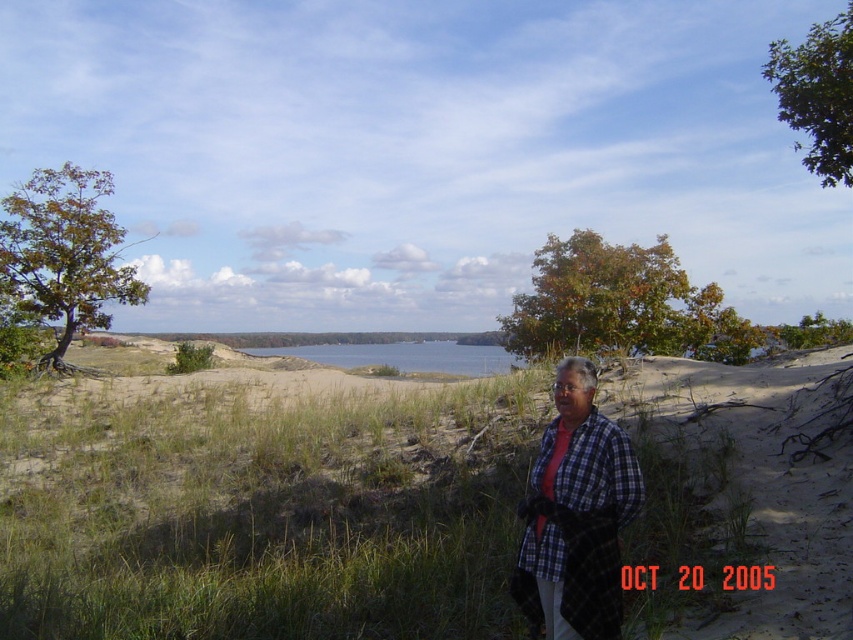
How far apart are green leafy tree at upper left and blue water at center?

A distance of 18.32 meters exists between green leafy tree at upper left and blue water at center.

Does green leafy tree at upper left have a lesser height compared to blue water at center?

Incorrect, green leafy tree at upper left's height does not fall short of blue water at center's.

Is point (74, 189) positioned before point (457, 353)?

Yes, point (74, 189) is closer to viewer.

This screenshot has width=853, height=640. Find the location of `green leafy tree at upper left`. green leafy tree at upper left is located at coordinates 65,253.

Which is behind, point (599, 504) or point (15, 195)?

The point (15, 195) is behind.

Is green grass at lower center to the left of green leafy tree at upper left from the viewer's perspective?

In fact, green grass at lower center is to the right of green leafy tree at upper left.

At what (x,y) coordinates should I click in order to perform the action: click on green grass at lower center. Please return your answer as a coordinate pair (x, y). The height and width of the screenshot is (640, 853). Looking at the image, I should click on (265, 508).

Locate an element on the screen. Image resolution: width=853 pixels, height=640 pixels. green grass at lower center is located at coordinates (265, 508).

Is point (477, 474) behind point (573, 273)?

No, it is in front of (573, 273).

Between green grass at lower center and green leafy tree at upper center, which one is positioned lower?

green grass at lower center

Is point (675, 442) closer to viewer compared to point (659, 346)?

Yes, it is.

Find the location of `green grass at lower center`. green grass at lower center is located at coordinates (265, 508).